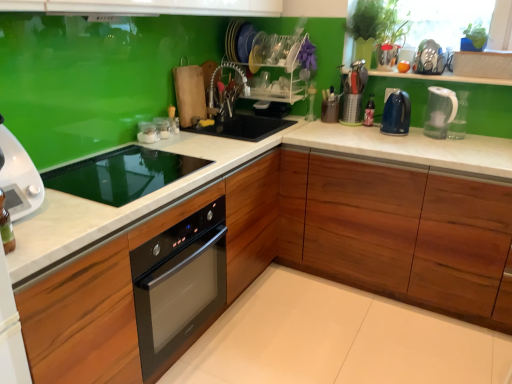
Where is `vacant area that lies in front of transparent glass bottle at upper right, the second bottle viewed from the right`? vacant area that lies in front of transparent glass bottle at upper right, the second bottle viewed from the right is located at coordinates (309, 127).